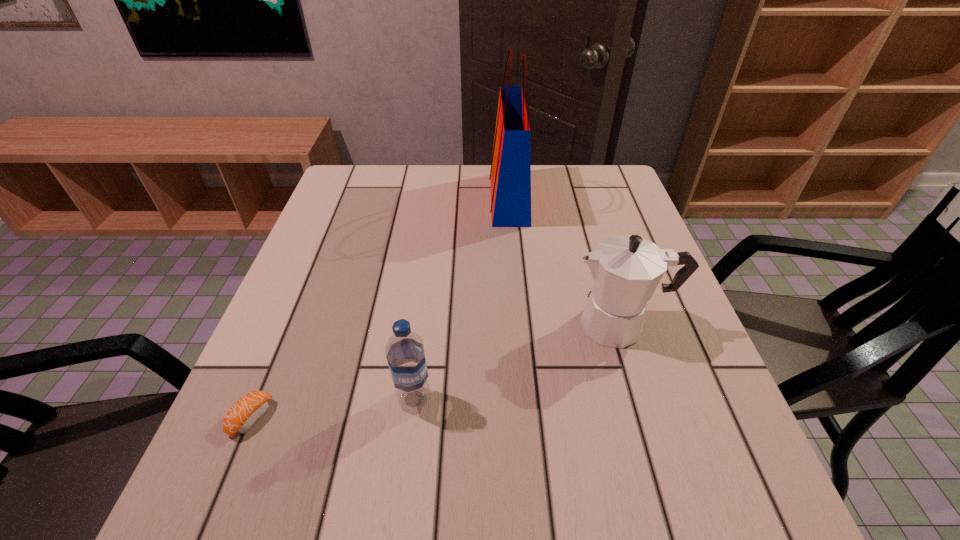
Where is `blank space at the left edge of the desktop`? The image size is (960, 540). blank space at the left edge of the desktop is located at coordinates (347, 337).

Locate an element on the screen. vacant space at the right edge of the desktop is located at coordinates (632, 213).

This screenshot has width=960, height=540. In the image, there is a desktop. Find the location of `free space at the far left corner`. free space at the far left corner is located at coordinates [384, 192].

At what (x,y) coordinates should I click in order to perform the action: click on vacant space at the near left corner. Please return your answer as a coordinate pair (x, y). The image size is (960, 540). Looking at the image, I should click on (281, 526).

You are a GUI agent. You are given a task and a screenshot of the screen. Output one action in this format:
    pyautogui.click(x=<x>, y=<y>)
    Task: Click on the free space at the near right corner of the desktop
    This screenshot has width=960, height=540.
    Given the screenshot: What is the action you would take?
    pyautogui.click(x=736, y=531)

Find the location of a particular element. The width and height of the screenshot is (960, 540). free space between the water bottle and the rightmost object is located at coordinates (517, 362).

Image resolution: width=960 pixels, height=540 pixels. Identify the location of vacant point located between the second farthest object and the water bottle. tap(517, 362).

The width and height of the screenshot is (960, 540). Find the location of `vacant area that lies between the third object from left to right and the third object from right to left`. vacant area that lies between the third object from left to right and the third object from right to left is located at coordinates (462, 299).

This screenshot has width=960, height=540. Find the location of `unoccupied area between the tallest object and the third nearest object`. unoccupied area between the tallest object and the third nearest object is located at coordinates (564, 262).

Locate an element on the screen. empty location between the second farthest object and the shortest object is located at coordinates click(436, 371).